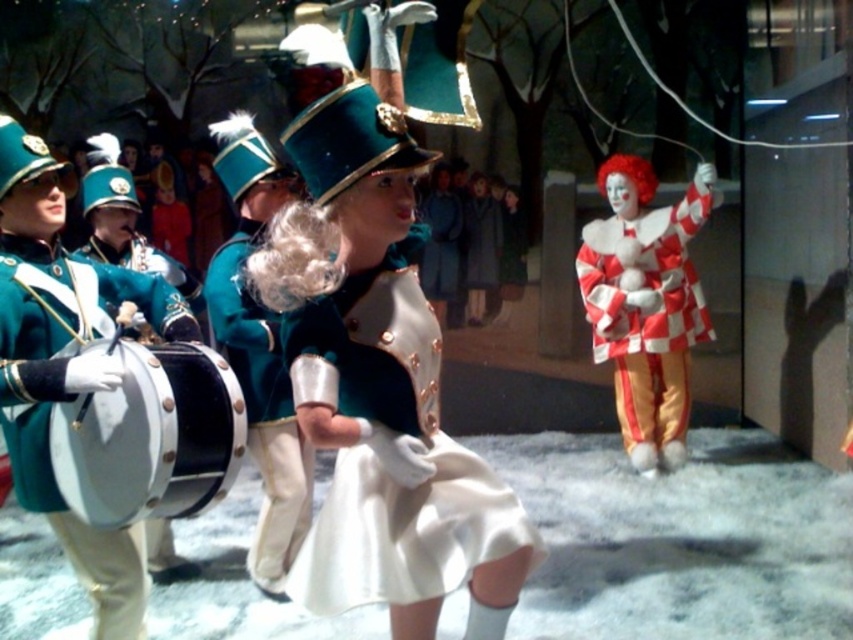
You are an audience member at the parade watching the performance. You see the checkered fabric clown at right and the shiny black drum at left. Which object is positioned to the right of the other?

The checkered fabric clown at right is positioned to the right of the shiny black drum at left.

You are a photographer at the parade. You want to take a photo of the Ronald McDonald character. However, you notice a point at coordinate [151,436] that might be blocking your view. Where exactly is this point located?

The point at coordinate [151,436] is on the shiny black drum at left, so it is blocking the view of Ronald McDonald in the background.

You are a photographer standing in the middle of the parade route. You need to capture a photo that includes both the green fabric drum at left and the checkered fabric clown at right. Based on their positions, which object should be placed on the left side of the photo to ensure both are in frame?

The green fabric drum at left should be placed on the left side of the photo since it is already positioned to the left of the checkered fabric clown at right, ensuring both are included in the frame.